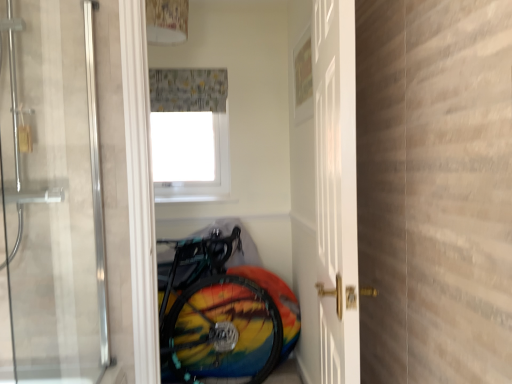
What is the approximate width of white glossy door at center, which is counted as the second door, starting from the left?

white glossy door at center, which is counted as the second door, starting from the left, is 6.28 inches wide.

In order to click on rainbow painted tire at lower center in this screenshot , I will do tap(221, 332).

What do you see at coordinates (188, 90) in the screenshot? I see `printed fabric shower curtain at upper center` at bounding box center [188, 90].

The height and width of the screenshot is (384, 512). Find the location of `transparent glass door at center, positioned as the 1th door in left-to-right order`. transparent glass door at center, positioned as the 1th door in left-to-right order is located at coordinates (52, 192).

The width and height of the screenshot is (512, 384). In order to click on white glossy door at center, which is counted as the second door, starting from the left in this screenshot , I will do `click(325, 189)`.

Looking at the image, does rainbow painted tire at lower center seem bigger or smaller compared to white matte window screen at upper center?

Clearly, rainbow painted tire at lower center is larger in size than white matte window screen at upper center.

Would you say rainbow painted tire at lower center is a long distance from white matte window screen at upper center?

No, rainbow painted tire at lower center is not far away from white matte window screen at upper center.

Would you say rainbow painted tire at lower center contains white matte window screen at upper center?

No.

This screenshot has height=384, width=512. I want to click on window screen positioned vertically above the rainbow painted tire at lower center (from a real-world perspective), so click(x=185, y=147).

From the image's perspective, which object appears higher, white matte window screen at upper center or white glossy door at center, which is counted as the second door, starting from the left?

white matte window screen at upper center, from the image's perspective.

Which object is positioned more to the left, white matte window screen at upper center or white glossy door at center, which is counted as the second door, starting from the left?

white matte window screen at upper center.

Does point (195, 144) come in front of point (346, 239)?

No, (195, 144) is further to viewer.

Looking at the image, does white matte window screen at upper center seem bigger or smaller compared to white glossy door at center, which is counted as the second door, starting from the left?

In the image, white matte window screen at upper center appears to be smaller than white glossy door at center, which is counted as the second door, starting from the left.

The width and height of the screenshot is (512, 384). Find the location of `bicycle wheel below the transparent glass door at center, the second door when ordered from right to left (from a real-world perspective)`. bicycle wheel below the transparent glass door at center, the second door when ordered from right to left (from a real-world perspective) is located at coordinates (221, 332).

Is transparent glass door at center, the second door when ordered from right to left, not within rainbow painted tire at lower center?

Yes, transparent glass door at center, the second door when ordered from right to left, is not within rainbow painted tire at lower center.

From the image's perspective, is transparent glass door at center, positioned as the 1th door in left-to-right order, over rainbow painted tire at lower center?

Yes, from the image's perspective, transparent glass door at center, positioned as the 1th door in left-to-right order, is over rainbow painted tire at lower center.

Do you think white matte window screen at upper center is within rainbow painted tire at lower center, or outside of it?

white matte window screen at upper center is not inside rainbow painted tire at lower center, it's outside.

This screenshot has height=384, width=512. I want to click on window screen that appears behind the rainbow painted tire at lower center, so click(185, 147).

Does white matte window screen at upper center have a greater height compared to rainbow painted tire at lower center?

Incorrect, the height of white matte window screen at upper center is not larger of that of rainbow painted tire at lower center.

Is white matte window screen at upper center wider or thinner than rainbow painted tire at lower center?

In the image, white matte window screen at upper center appears to be more narrow than rainbow painted tire at lower center.

The image size is (512, 384). I want to click on shower curtain above the white matte window screen at upper center (from the image's perspective), so click(x=188, y=90).

From the image's perspective, is printed fabric shower curtain at upper center over white matte window screen at upper center?

Correct, printed fabric shower curtain at upper center appears higher than white matte window screen at upper center in the image.

Can you confirm if printed fabric shower curtain at upper center is thinner than white matte window screen at upper center?

Incorrect, the width of printed fabric shower curtain at upper center is not less than that of white matte window screen at upper center.

Which object is positioned more to the right, printed fabric shower curtain at upper center or white matte window screen at upper center?

printed fabric shower curtain at upper center.

Who is taller, white glossy door at center, which is the first door from right to left, or printed fabric shower curtain at upper center?

With more height is white glossy door at center, which is the first door from right to left.

Considering the relative positions of white glossy door at center, which is the first door from right to left, and printed fabric shower curtain at upper center in the image provided, is white glossy door at center, which is the first door from right to left, to the left of printed fabric shower curtain at upper center from the viewer's perspective?

No.

Considering the positions of objects white glossy door at center, which is the first door from right to left, and printed fabric shower curtain at upper center in the image provided, who is in front, white glossy door at center, which is the first door from right to left, or printed fabric shower curtain at upper center?

white glossy door at center, which is the first door from right to left, is in front.

Based on their sizes in the image, would you say printed fabric shower curtain at upper center is bigger or smaller than white glossy door at center, which is counted as the second door, starting from the left?

printed fabric shower curtain at upper center is smaller than white glossy door at center, which is counted as the second door, starting from the left.

Does printed fabric shower curtain at upper center lie in front of white glossy door at center, which is the first door from right to left?

No, printed fabric shower curtain at upper center is further to the viewer.

Looking at this image, are printed fabric shower curtain at upper center and white glossy door at center, which is the first door from right to left, located far from each other?

Actually, printed fabric shower curtain at upper center and white glossy door at center, which is the first door from right to left, are a little close together.

Would you say printed fabric shower curtain at upper center is outside white glossy door at center, which is the first door from right to left?

Yes.

What are the coordinates of `bicycle wheel that is on the right side of white matte window screen at upper center` in the screenshot? It's located at click(x=221, y=332).

I want to click on the 2nd door positioned below the white matte window screen at upper center (from the image's perspective), so click(325, 189).

Based on their spatial positions, is printed fabric shower curtain at upper center or white matte window screen at upper center further from transparent glass door at center, positioned as the 1th door in left-to-right order?

The object further to transparent glass door at center, positioned as the 1th door in left-to-right order, is white matte window screen at upper center.

Looking at this image, when comparing their distances from rainbow painted tire at lower center, does printed fabric shower curtain at upper center or white matte window screen at upper center seem further?

Among the two, printed fabric shower curtain at upper center is located further to rainbow painted tire at lower center.

Based on their spatial positions, is white glossy door at center, which is counted as the second door, starting from the left, or transparent glass door at center, the second door when ordered from right to left, closer to rainbow painted tire at lower center?

Based on the image, white glossy door at center, which is counted as the second door, starting from the left, appears to be nearer to rainbow painted tire at lower center.

Looking at this image, estimate the real-world distances between objects in this image. Which object is closer to white glossy door at center, which is the first door from right to left, printed fabric shower curtain at upper center or transparent glass door at center, the second door when ordered from right to left?

Among the two, printed fabric shower curtain at upper center is located nearer to white glossy door at center, which is the first door from right to left.

Which object lies nearer to the anchor point rainbow painted tire at lower center, transparent glass door at center, the second door when ordered from right to left, or white matte window screen at upper center?

white matte window screen at upper center is positioned closer to the anchor rainbow painted tire at lower center.

From the image, which object appears to be farther from transparent glass door at center, positioned as the 1th door in left-to-right order, white glossy door at center, which is counted as the second door, starting from the left, or rainbow painted tire at lower center?

rainbow painted tire at lower center lies further to transparent glass door at center, positioned as the 1th door in left-to-right order, than the other object.

Estimate the real-world distances between objects in this image. Which object is further from rainbow painted tire at lower center, white matte window screen at upper center or printed fabric shower curtain at upper center?

printed fabric shower curtain at upper center is further to rainbow painted tire at lower center.

Looking at the image, which one is located further to white matte window screen at upper center, transparent glass door at center, positioned as the 1th door in left-to-right order, or white glossy door at center, which is counted as the second door, starting from the left?

transparent glass door at center, positioned as the 1th door in left-to-right order.

Locate an element on the screen. Image resolution: width=512 pixels, height=384 pixels. bicycle wheel positioned between white glossy door at center, which is counted as the second door, starting from the left, and white matte window screen at upper center from near to far is located at coordinates (221, 332).

You are a GUI agent. You are given a task and a screenshot of the screen. Output one action in this format:
    pyautogui.click(x=<x>, y=<y>)
    Task: Click on the window screen between printed fabric shower curtain at upper center and rainbow painted tire at lower center in the vertical direction
    This screenshot has height=384, width=512.
    Given the screenshot: What is the action you would take?
    pyautogui.click(x=185, y=147)

Identify the location of bicycle wheel located between transparent glass door at center, the second door when ordered from right to left, and printed fabric shower curtain at upper center in the depth direction. The image size is (512, 384). (221, 332).

Where is `bicycle wheel between white glossy door at center, which is the first door from right to left, and printed fabric shower curtain at upper center, along the z-axis`? bicycle wheel between white glossy door at center, which is the first door from right to left, and printed fabric shower curtain at upper center, along the z-axis is located at coordinates (221, 332).